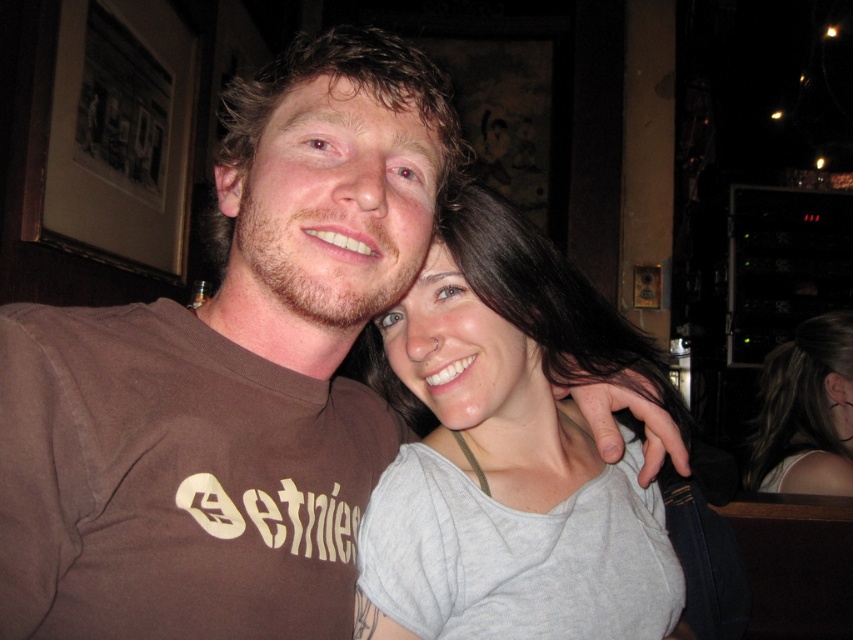
You are a photographer standing at a distance. You want to take a portrait of the gray cotton shirt at center. What is the recommended minimum distance you should maintain to ensure the subject is in focus?

The gray cotton shirt at center is 26.46 inches from the camera, so the recommended minimum distance to maintain focus is at least 26.46 inches.

What is the position of the gray cotton shirt at center in the image?

The gray cotton shirt at center is located at point (x=509, y=449).

You are standing in the bar and want to take a photo of both individuals. The camera you have can only focus on one point at a time. If you focus on point 1, which is at coordinate point (x=550, y=275), will the other point at (x=824, y=452) also be in focus?

Point 1 at coordinate point (x=550, y=275) is in front of point (x=824, y=452). Since the camera focuses on the point in front, the other point might be out of focus. However, the depth of field could allow both to be in focus depending on the aperture setting. Without specific aperture details, it is uncertain.